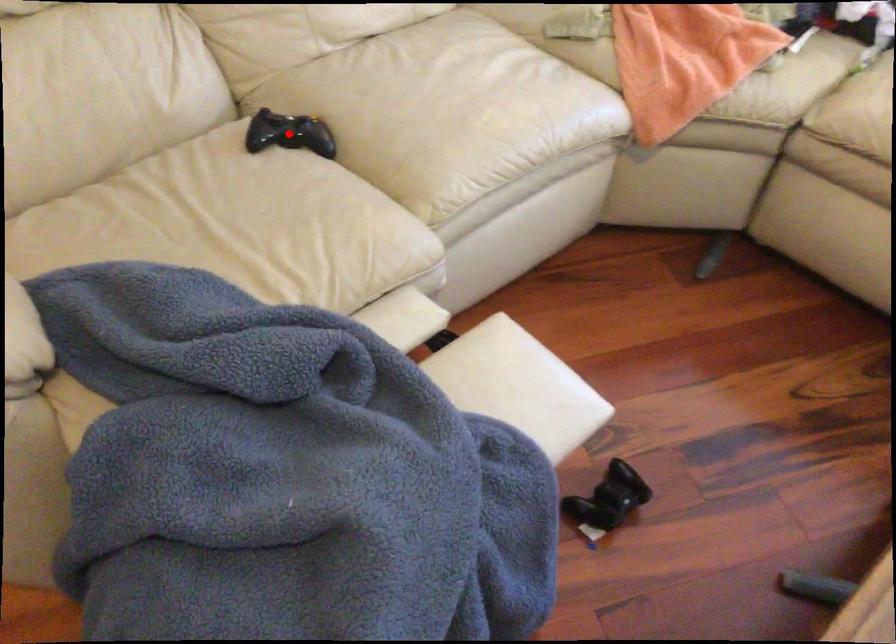
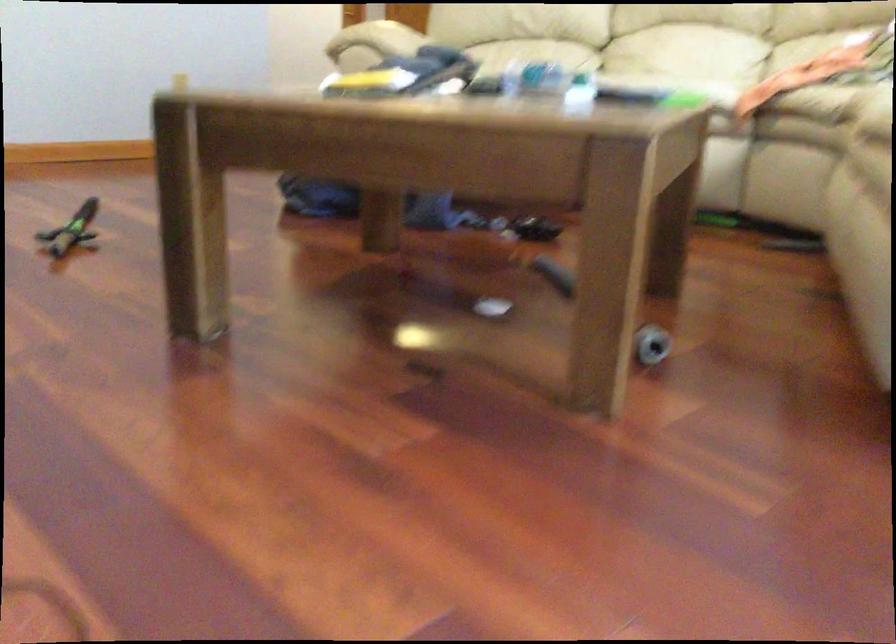
Question: I am providing you with two images of the same scene from different viewpoints. A red point is marked on the first image. At the location where the point appears in image 1, is it still visible in image 2?

Choices:
 (A) Yes
 (B) No

Answer: (B)